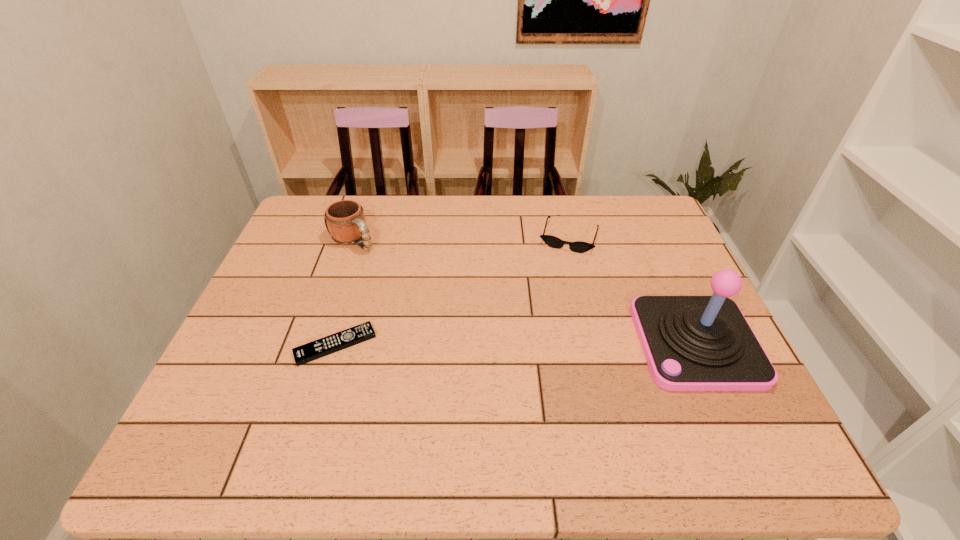
Find the location of a particular element. Image resolution: width=960 pixels, height=540 pixels. vacant area that lies between the third tallest object and the tallest object is located at coordinates (633, 290).

At what (x,y) coordinates should I click in order to perform the action: click on vacant area that lies between the third object from left to right and the third shortest object. Please return your answer as a coordinate pair (x, y). Image resolution: width=960 pixels, height=540 pixels. Looking at the image, I should click on (461, 239).

Identify the location of free space between the tallest object and the mug. The image size is (960, 540). (524, 292).

I want to click on blank region between the third shortest object and the second object from right to left, so click(461, 239).

Locate an element on the screen. free space that is in between the rightmost object and the shortest object is located at coordinates (516, 344).

At what (x,y) coordinates should I click in order to perform the action: click on free space between the second tallest object and the joystick. Please return your answer as a coordinate pair (x, y). This screenshot has width=960, height=540. Looking at the image, I should click on (524, 292).

The image size is (960, 540). What are the coordinates of `free area in between the shortest object and the mug` in the screenshot? It's located at (345, 293).

At what (x,y) coordinates should I click in order to perform the action: click on free space between the third shortest object and the remote control. Please return your answer as a coordinate pair (x, y). The image size is (960, 540). Looking at the image, I should click on (345, 293).

Identify the location of vacant area that lies between the sunglasses and the shortest object. This screenshot has height=540, width=960. (452, 291).

Select which object is the second closest to the third tallest object. Please provide its 2D coordinates. Your answer should be formatted as a tuple, i.e. [(x, y)], where the tuple contains the x and y coordinates of a point satisfying the conditions above.

[(346, 224)]